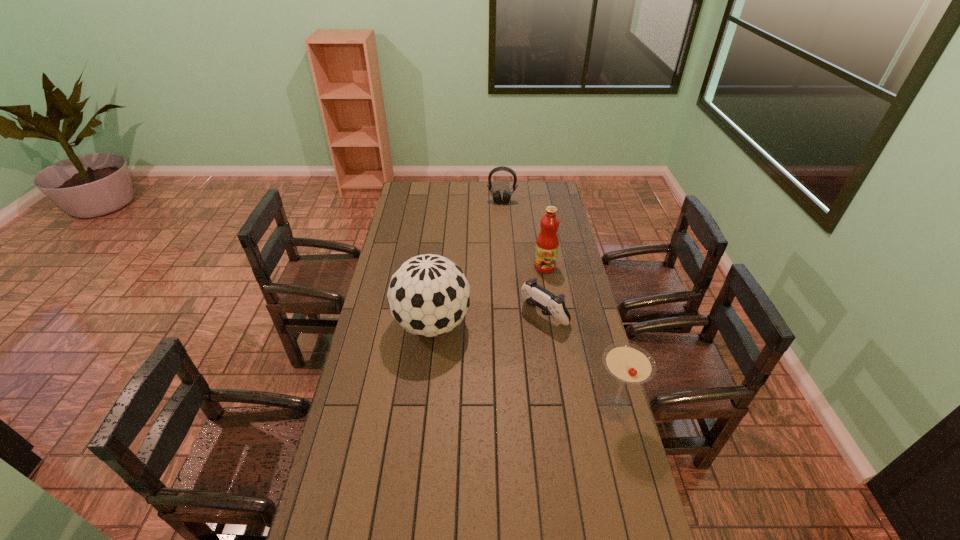
Where is `soccer ball`? This screenshot has height=540, width=960. soccer ball is located at coordinates (428, 295).

What are the coordinates of `the rightmost object` in the screenshot? It's located at (629, 363).

Where is `the third tallest object`? The image size is (960, 540). the third tallest object is located at coordinates (629, 363).

Where is `the fourth tallest object`? the fourth tallest object is located at coordinates (496, 195).

The image size is (960, 540). Find the location of `headset`. headset is located at coordinates (496, 195).

The image size is (960, 540). Find the location of `the fourth nearest object`. the fourth nearest object is located at coordinates (547, 244).

The image size is (960, 540). Identify the location of control. (535, 295).

Image resolution: width=960 pixels, height=540 pixels. In order to click on vacant space located 0.230m on the front of the soccer ball in this screenshot , I will do `click(423, 408)`.

Locate an element on the screen. The width and height of the screenshot is (960, 540). vacant space situated on the left of the third tallest object is located at coordinates (516, 408).

In order to click on free space located 0.250m on the front-facing side of the farthest object in this screenshot , I will do `click(499, 232)`.